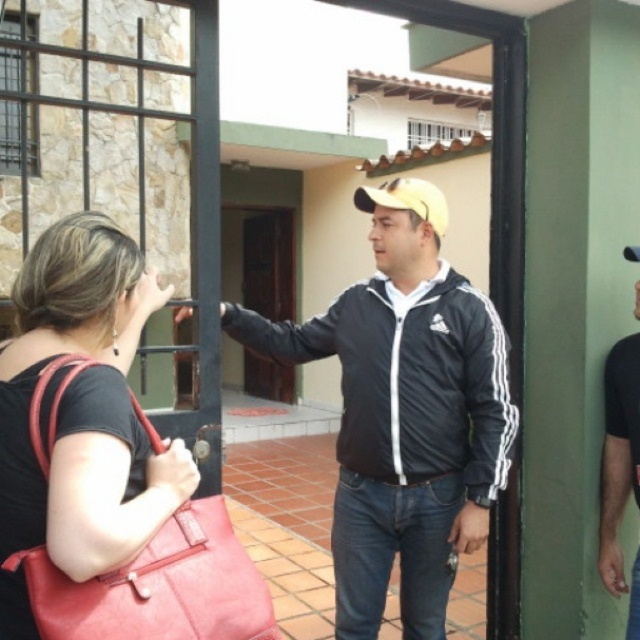
Question: Which point is closer to the camera?

Choices:
 (A) (100, 358)
 (B) (243, 337)
 (C) (628, 433)
 (D) (269, 364)

Answer: (A)

Question: Can you confirm if matte pink handbag at left is smaller than brown wooden door at center?

Choices:
 (A) yes
 (B) no

Answer: (A)

Question: Can you confirm if black matte jacket at center is wider than yellow matte baseball hat at center?

Choices:
 (A) no
 (B) yes

Answer: (B)

Question: Which object is the closest to the black matte jacket at center?

Choices:
 (A) brown wooden door at center
 (B) yellow matte baseball hat at center
 (C) matte pink handbag at left
 (D) black matte jacket at right

Answer: (B)

Question: From the image, what is the correct spatial relationship of black matte jacket at center in relation to black matte jacket at right?

Choices:
 (A) below
 (B) above

Answer: (B)

Question: Considering the real-world distances, which object is farthest from the yellow matte baseball hat at center?

Choices:
 (A) brown wooden door at center
 (B) matte pink handbag at left

Answer: (A)